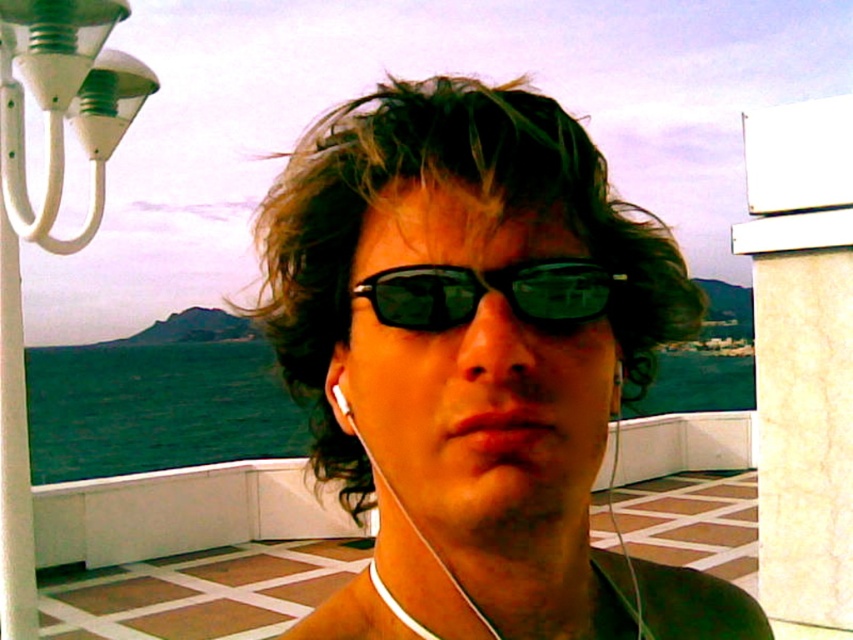
Can you confirm if dark curly hair at center is taller than green reflective plastic goggles at center?

Indeed, dark curly hair at center has a greater height compared to green reflective plastic goggles at center.

Between dark curly hair at center and green reflective plastic goggles at center, which one is positioned lower?

Positioned lower is dark curly hair at center.

Which is in front, point (405, 150) or point (397, 305)?

Point (397, 305) is more forward.

I want to click on dark curly hair at center, so click(460, 196).

Can you confirm if green reflective plastic goggles at center is wider than white earphone at center?

Yes.

Who is more distant from viewer, (x=515, y=273) or (x=344, y=412)?

Point (x=344, y=412)

The width and height of the screenshot is (853, 640). What are the coordinates of `green reflective plastic goggles at center` in the screenshot? It's located at (495, 291).

I want to click on green reflective plastic goggles at center, so click(x=495, y=291).

Is dark curly hair at center further to camera compared to white earphone at center?

That is False.

Between dark curly hair at center and white earphone at center, which one is positioned lower?

dark curly hair at center

This screenshot has height=640, width=853. Describe the element at coordinates (460, 196) in the screenshot. I see `dark curly hair at center` at that location.

At what (x,y) coordinates should I click in order to perform the action: click on dark curly hair at center. Please return your answer as a coordinate pair (x, y). This screenshot has width=853, height=640. Looking at the image, I should click on (460, 196).